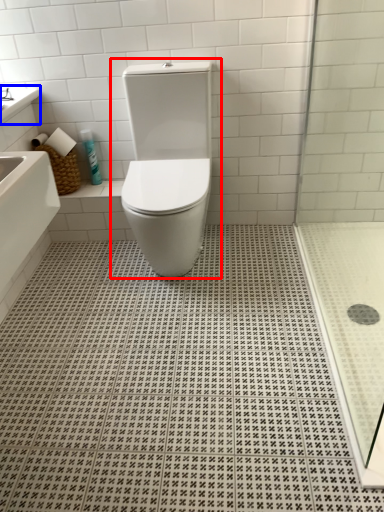
Question: Which point is further to the camera, toilet (highlighted by a red box) or counter top (highlighted by a blue box)?

Choices:
 (A) toilet
 (B) counter top

Answer: (B)